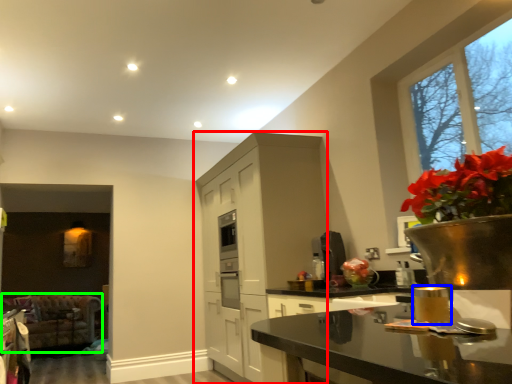
Question: Considering the real-world distances, which object is farthest from cabinetry (highlighted by a red box)? candle holder (highlighted by a blue box) or armchair (highlighted by a green box)?

Choices:
 (A) candle holder
 (B) armchair

Answer: (A)